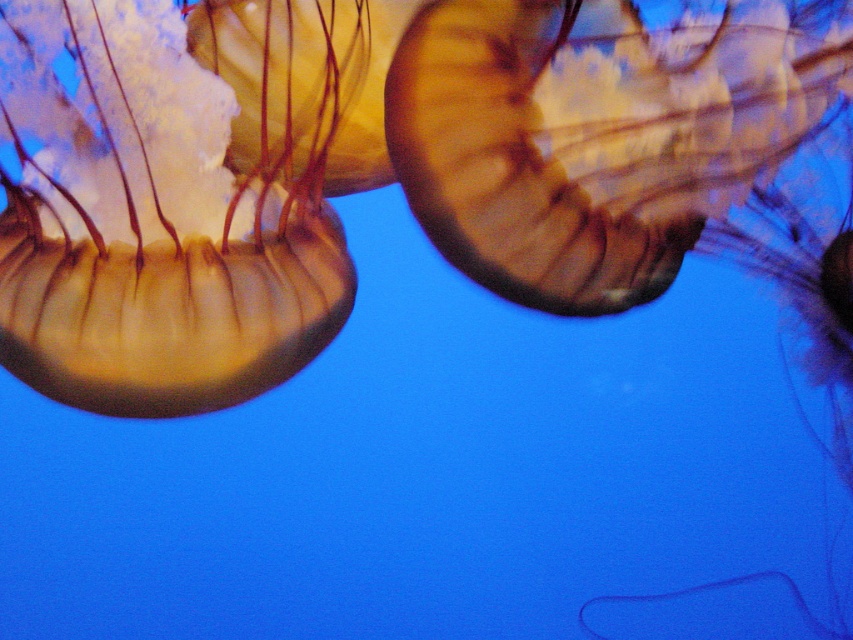
Does translucent gelatinous at left appear on the left side of translucent gelatinous at upper right?

Yes, translucent gelatinous at left is to the left of translucent gelatinous at upper right.

From the picture: Is translucent gelatinous at left closer to camera compared to translucent gelatinous at upper right?

Yes.

Describe the element at coordinates (148, 225) in the screenshot. I see `translucent gelatinous at left` at that location.

You are a GUI agent. You are given a task and a screenshot of the screen. Output one action in this format:
    pyautogui.click(x=<x>, y=<y>)
    Task: Click on the translucent gelatinous at left
    The width and height of the screenshot is (853, 640).
    Given the screenshot: What is the action you would take?
    (x=148, y=225)